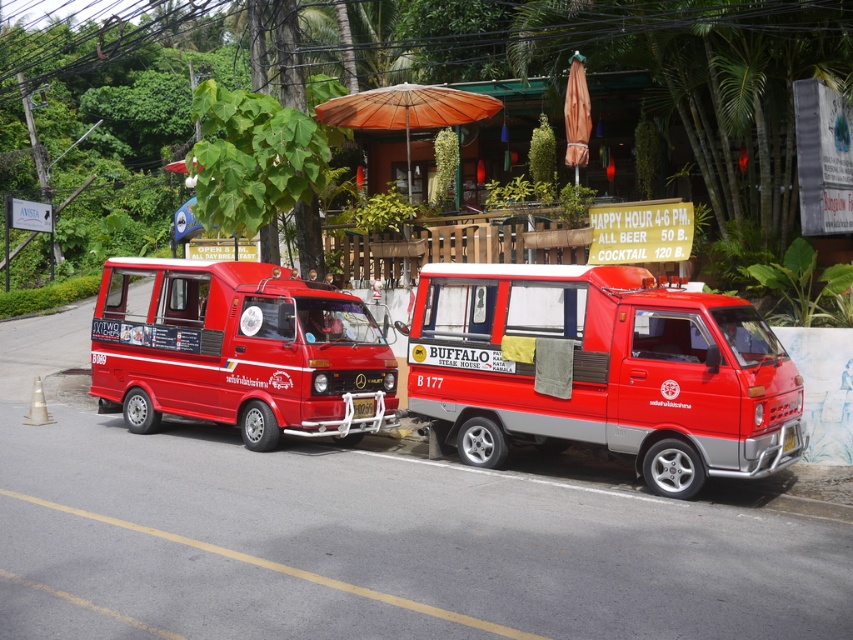
Is matte red van at left positioned in front of orange fabric umbrella at upper center?

That is True.

From the picture: Is matte red van at left taller than orange fabric umbrella at upper center?

Correct, matte red van at left is much taller as orange fabric umbrella at upper center.

Who is more distant from viewer, (194, 276) or (569, 129)?

The point (569, 129) is more distant.

Identify the location of matte red van at left. This screenshot has height=640, width=853. (236, 349).

Is shiny red van at center to the right of orange woven umbrella at center from the viewer's perspective?

Correct, you'll find shiny red van at center to the right of orange woven umbrella at center.

Is shiny red van at center wider than orange woven umbrella at center?

Yes.

This screenshot has height=640, width=853. What are the coordinates of `shiny red van at center` in the screenshot? It's located at (605, 371).

Between orange fabric umbrella at upper center and yellow plastic license plate at center, which one is positioned higher?

Positioned higher is orange fabric umbrella at upper center.

Describe the element at coordinates (576, 115) in the screenshot. I see `orange fabric umbrella at upper center` at that location.

Where is `orange fabric umbrella at upper center`? The width and height of the screenshot is (853, 640). orange fabric umbrella at upper center is located at coordinates (576, 115).